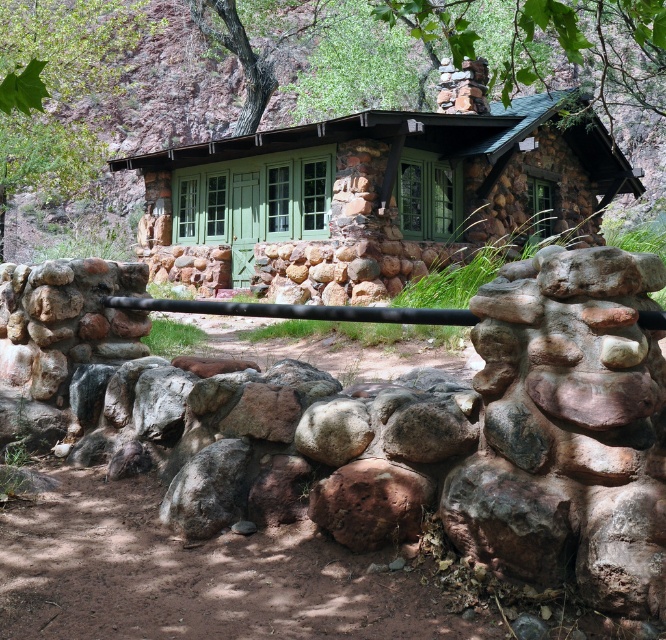
Is green stone cabin at center smaller than green stone chimney at upper center?

Correct, green stone cabin at center occupies less space than green stone chimney at upper center.

Which is more to the left, green stone cabin at center or green stone chimney at upper center?

From the viewer's perspective, green stone cabin at center appears more on the left side.

Who is more distant from viewer, (374, 204) or (637, 86)?

Point (637, 86)

Identify the location of green stone cabin at center. The image size is (666, 640). (374, 193).